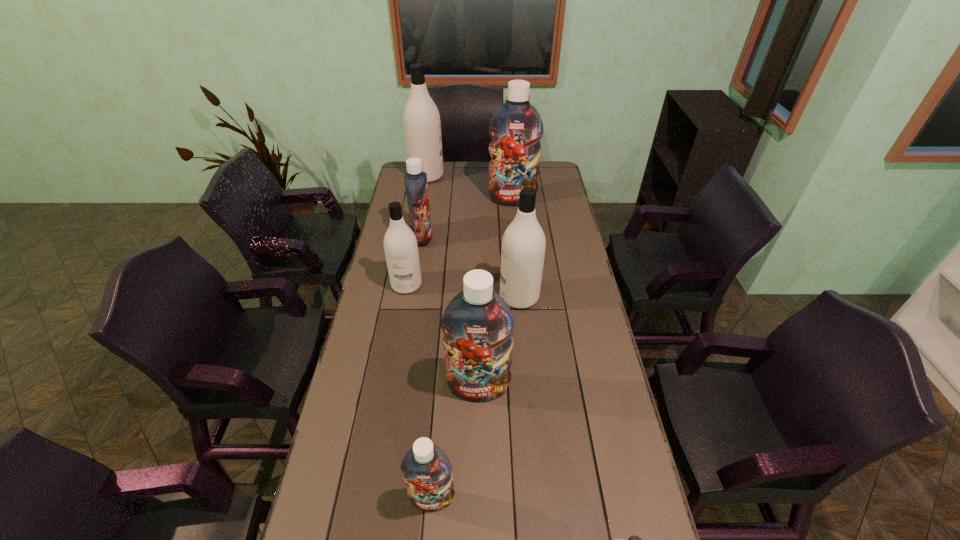
This screenshot has width=960, height=540. Find the location of `free space located 0.060m on the front label of the nearest blue shampoo`. free space located 0.060m on the front label of the nearest blue shampoo is located at coordinates (429, 539).

Find the location of `object positioned at the far edge`. object positioned at the far edge is located at coordinates (421, 119).

In order to click on object at the right edge in this screenshot , I will do `click(516, 128)`.

I want to click on object that is at the far left corner, so click(x=421, y=119).

In the image, there is a desktop. Where is `vacant space at the far edge`? The image size is (960, 540). vacant space at the far edge is located at coordinates (448, 174).

In the image, there is a desktop. Find the location of `vacant space at the left edge`. vacant space at the left edge is located at coordinates (371, 424).

I want to click on free point at the right edge, so click(563, 372).

Identify the location of free space at the far right corner of the desktop. The image size is (960, 540). (546, 176).

Locate an element on the screen. Image resolution: width=960 pixels, height=540 pixels. unoccupied position between the sixth nearest shampoo and the second biggest white shampoo is located at coordinates (470, 267).

Identify the location of free space between the farthest shampoo and the farthest blue shampoo. This screenshot has height=540, width=960. (469, 187).